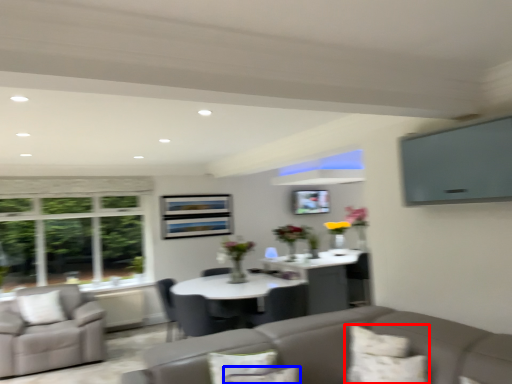
Question: Which object is closer to the camera taking this photo, pillow (highlighted by a red box) or pillow (highlighted by a blue box)?

Choices:
 (A) pillow
 (B) pillow

Answer: (B)